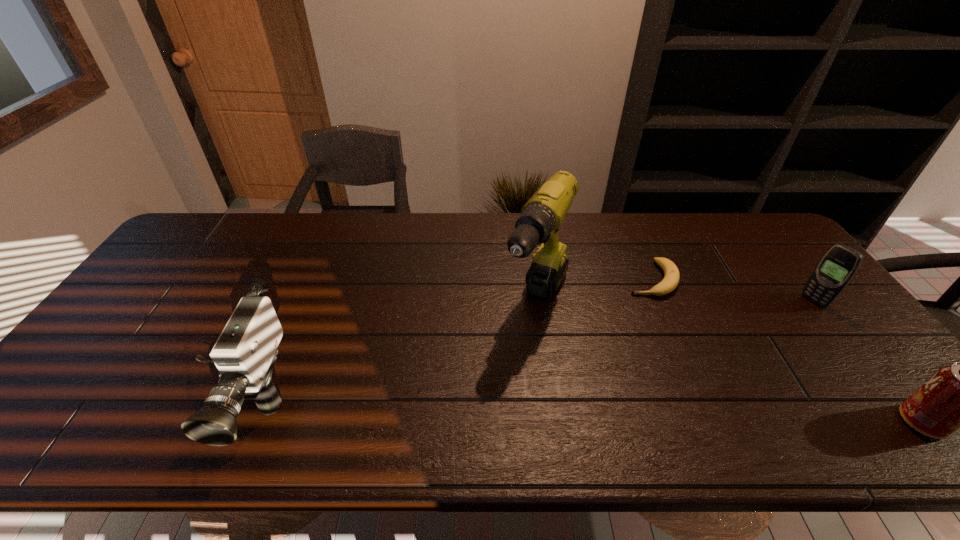
Find the location of a particular element. The width and height of the screenshot is (960, 540). free space on the desktop that is between the camcorder and the fourth tallest object and is positioned at the stem of the shortest object is located at coordinates (581, 415).

The width and height of the screenshot is (960, 540). Identify the location of vacant space on the desktop that is between the leftmost object and the second shortest object and is positioned on the handle side of the fourth object from right to left. (474, 412).

Locate an element on the screen. free space on the desktop that is between the camcorder and the second shortest object and is positioned on the screen of the cellular telephone is located at coordinates (629, 416).